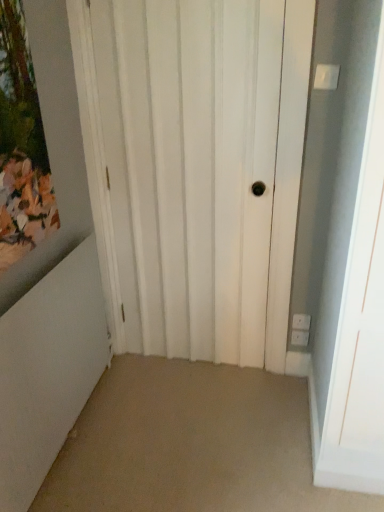
Question: Looking at the image, does wooden painted picture frame at upper left seem bigger or smaller compared to white matte door at center?

Choices:
 (A) small
 (B) big

Answer: (A)

Question: Is wooden painted picture frame at upper left in front of or behind white matte door at center in the image?

Choices:
 (A) behind
 (B) front

Answer: (B)

Question: Is wooden painted picture frame at upper left wider or thinner than white matte door at center?

Choices:
 (A) wide
 (B) thin

Answer: (A)

Question: Would you say white matte door at center is inside or outside wooden painted picture frame at upper left?

Choices:
 (A) inside
 (B) outside

Answer: (B)

Question: From a real-world perspective, is white matte door at center above or below wooden painted picture frame at upper left?

Choices:
 (A) below
 (B) above

Answer: (A)

Question: Is white matte door at center taller or shorter than wooden painted picture frame at upper left?

Choices:
 (A) short
 (B) tall

Answer: (B)

Question: Considering the positions of white matte door at center and wooden painted picture frame at upper left in the image, is white matte door at center bigger or smaller than wooden painted picture frame at upper left?

Choices:
 (A) big
 (B) small

Answer: (A)